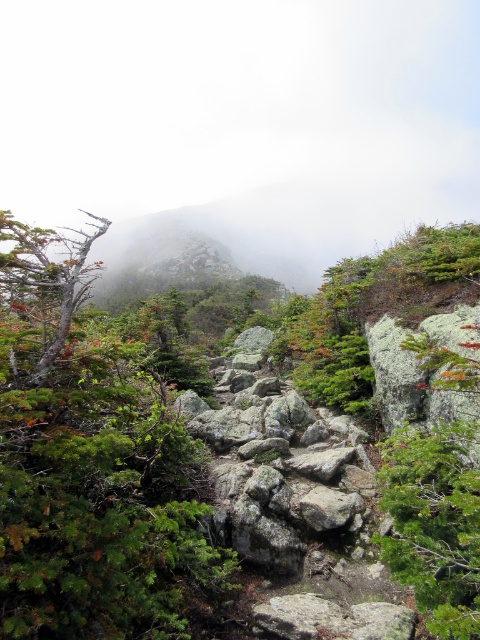
Question: Does green matte tree at left appear under smooth gray tree at left?

Choices:
 (A) no
 (B) yes

Answer: (B)

Question: Can you confirm if green matte tree at left is thinner than smooth gray tree at left?

Choices:
 (A) yes
 (B) no

Answer: (A)

Question: Which of the following is the farthest from the observer?

Choices:
 (A) (31, 291)
 (B) (54, 321)

Answer: (B)

Question: Does green matte tree at left appear on the left side of smooth gray tree at left?

Choices:
 (A) no
 (B) yes

Answer: (A)

Question: Which object appears farthest from the camera in this image?

Choices:
 (A) smooth gray tree at left
 (B) green matte tree at left

Answer: (A)